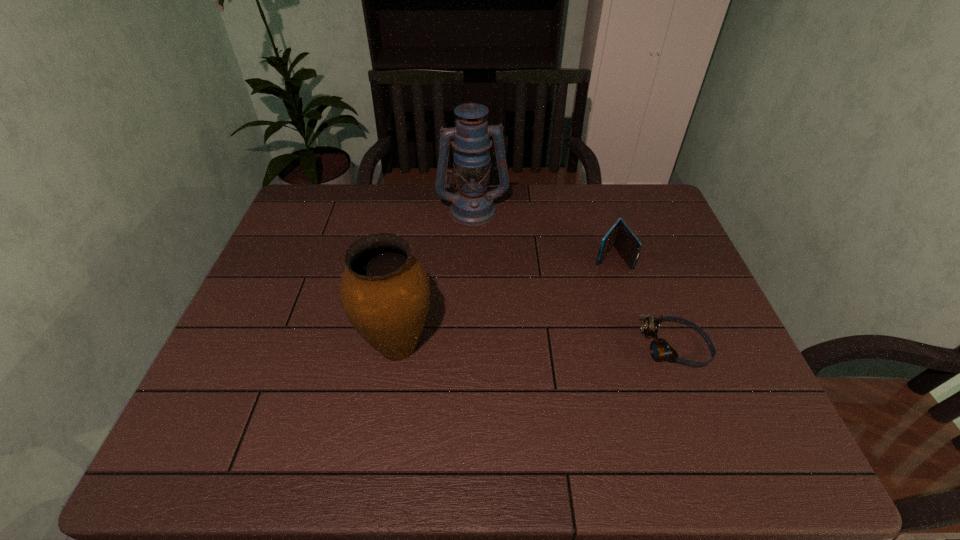
The height and width of the screenshot is (540, 960). Identify the location of vacant space on the desktop that is between the third shortest object and the goggles and is positioned on the exterior surface of the third tallest object. (541, 347).

What are the coordinates of `vacant spot on the desktop that is between the urn and the goggles and is positioned on the front-facing side of the lantern` in the screenshot? It's located at point(498,347).